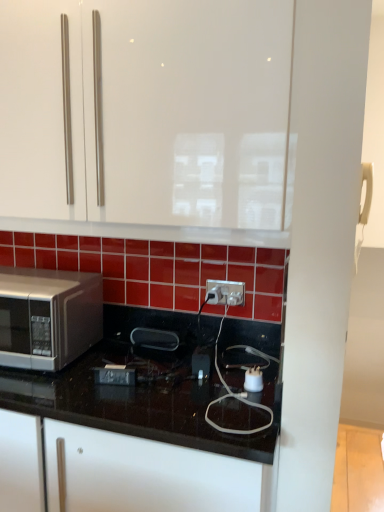
Question: Is white glossy cabinet at upper center not within white plastic electric outlet at center?

Choices:
 (A) yes
 (B) no

Answer: (A)

Question: From a real-world perspective, is white glossy cabinet at upper center physically above white plastic electric outlet at center?

Choices:
 (A) yes
 (B) no

Answer: (A)

Question: Does white glossy cabinet at upper center have a lesser height compared to white plastic electric outlet at center?

Choices:
 (A) no
 (B) yes

Answer: (A)

Question: Is white glossy cabinet at upper center to the left of white plastic electric outlet at center from the viewer's perspective?

Choices:
 (A) yes
 (B) no

Answer: (A)

Question: Can you confirm if white glossy cabinet at upper center is wider than white plastic electric outlet at center?

Choices:
 (A) no
 (B) yes

Answer: (B)

Question: Is black glossy countertop at lower left taller or shorter than white plastic electric outlet at center?

Choices:
 (A) tall
 (B) short

Answer: (A)

Question: Considering the positions of black glossy countertop at lower left and white plastic electric outlet at center in the image, is black glossy countertop at lower left wider or thinner than white plastic electric outlet at center?

Choices:
 (A) thin
 (B) wide

Answer: (B)

Question: Considering the positions of point (110, 400) and point (211, 287), is point (110, 400) closer or farther from the camera than point (211, 287)?

Choices:
 (A) closer
 (B) farther

Answer: (A)

Question: From the image's perspective, is black glossy countertop at lower left positioned above or below white plastic electric outlet at center?

Choices:
 (A) below
 (B) above

Answer: (A)

Question: Is white glossy cabinet at upper center wider or thinner than satin silver microwave at left?

Choices:
 (A) wide
 (B) thin

Answer: (B)

Question: Based on their sizes in the image, would you say white glossy cabinet at upper center is bigger or smaller than satin silver microwave at left?

Choices:
 (A) big
 (B) small

Answer: (A)

Question: Considering the relative positions of white glossy cabinet at upper center and satin silver microwave at left in the image provided, is white glossy cabinet at upper center to the left or to the right of satin silver microwave at left?

Choices:
 (A) left
 (B) right

Answer: (B)

Question: Is white glossy cabinet at upper center situated inside satin silver microwave at left or outside?

Choices:
 (A) inside
 (B) outside

Answer: (B)

Question: Considering the positions of satin silver microwave at left and white glossy cabinet at upper center in the image, is satin silver microwave at left taller or shorter than white glossy cabinet at upper center?

Choices:
 (A) tall
 (B) short

Answer: (B)

Question: Based on their sizes in the image, would you say satin silver microwave at left is bigger or smaller than white glossy cabinet at upper center?

Choices:
 (A) small
 (B) big

Answer: (A)